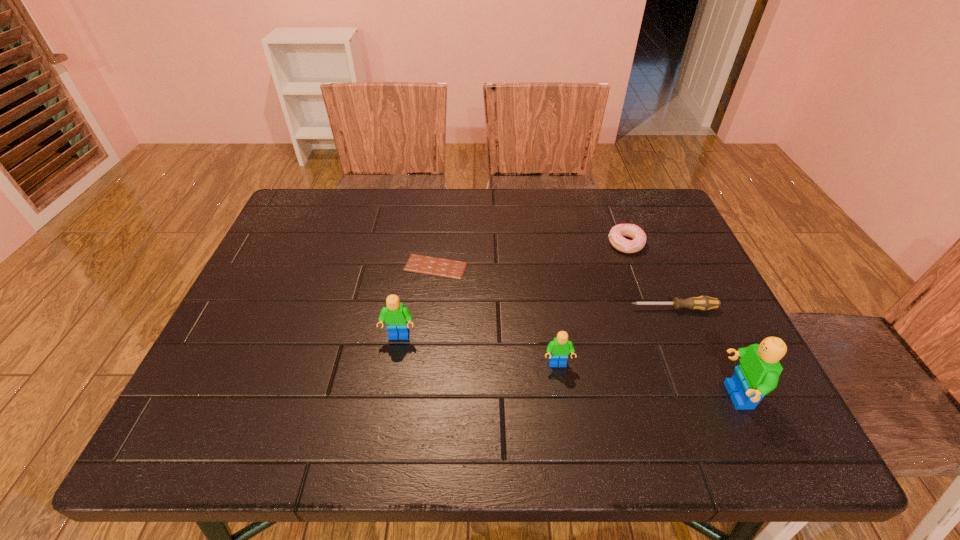
Locate an element on the screen. This screenshot has height=540, width=960. free area in between the third nearest object and the chocolate bar is located at coordinates (418, 302).

You are a GUI agent. You are given a task and a screenshot of the screen. Output one action in this format:
    pyautogui.click(x=<x>, y=<y>)
    Task: Click on the unoccupied area between the nearest Lego and the fourth shortest object
    Image resolution: width=960 pixels, height=540 pixels.
    Given the screenshot: What is the action you would take?
    pyautogui.click(x=646, y=380)

At what (x,y) coordinates should I click in order to perform the action: click on free space between the third farthest object and the chocolate bar. Please return your answer as a coordinate pair (x, y). The height and width of the screenshot is (540, 960). Looking at the image, I should click on (555, 288).

This screenshot has width=960, height=540. Identify the location of free point between the second farthest Lego and the leftmost Lego. (478, 350).

Find the location of `vacant point located between the nearest Lego and the doughnut`. vacant point located between the nearest Lego and the doughnut is located at coordinates (681, 320).

I want to click on unoccupied position between the shortest object and the screwdriver, so click(x=555, y=288).

This screenshot has height=540, width=960. What are the coordinates of `empty location between the fifth tallest object and the doughnut` in the screenshot? It's located at (650, 276).

Image resolution: width=960 pixels, height=540 pixels. Find the location of `free space between the leftmost Lego and the doughnut`. free space between the leftmost Lego and the doughnut is located at coordinates (513, 291).

This screenshot has height=540, width=960. Identify the location of free space between the fifth tallest object and the chocolate bar. (555, 288).

Where is `free spot between the nearest Lego and the second tallest object`? This screenshot has width=960, height=540. free spot between the nearest Lego and the second tallest object is located at coordinates (567, 366).